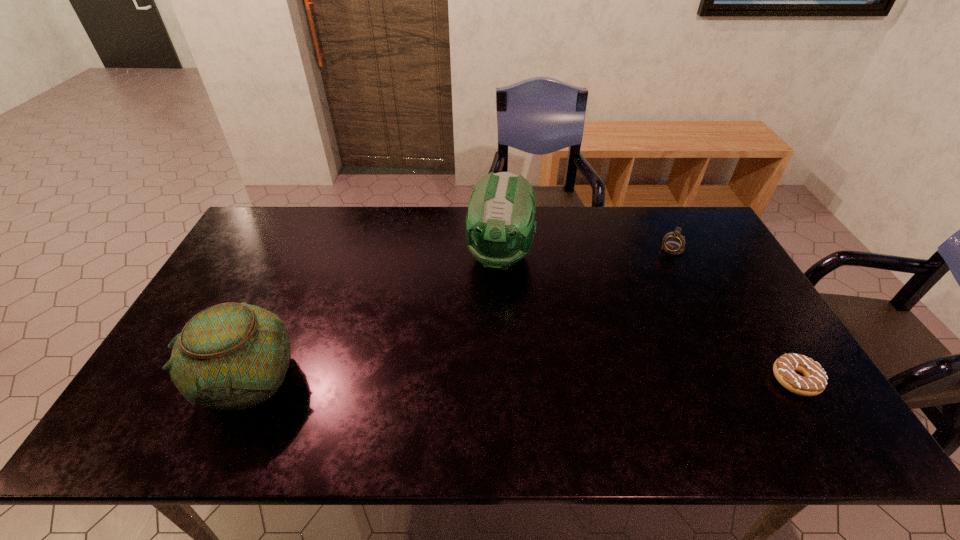
Image resolution: width=960 pixels, height=540 pixels. Identify the location of pottery. (231, 356).

Locate an element on the screen. The height and width of the screenshot is (540, 960). the second tallest object is located at coordinates (231, 356).

The width and height of the screenshot is (960, 540). Identify the location of the shortest object. (814, 382).

The height and width of the screenshot is (540, 960). In order to click on the rightmost object in this screenshot , I will do `click(814, 382)`.

This screenshot has width=960, height=540. In order to click on compass in this screenshot , I will do `click(673, 243)`.

The height and width of the screenshot is (540, 960). In order to click on the second shortest object in this screenshot , I will do `click(673, 243)`.

At what (x,y) coordinates should I click in order to perform the action: click on the second object from left to right. Please return your answer as a coordinate pair (x, y). The width and height of the screenshot is (960, 540). Looking at the image, I should click on (499, 230).

Locate an element on the screen. The image size is (960, 540). football helmet is located at coordinates (499, 230).

This screenshot has width=960, height=540. Find the location of `vacant space located 0.390m on the right of the pottery`. vacant space located 0.390m on the right of the pottery is located at coordinates (457, 379).

Where is `free space located 0.220m on the left of the doughnut`? free space located 0.220m on the left of the doughnut is located at coordinates (684, 380).